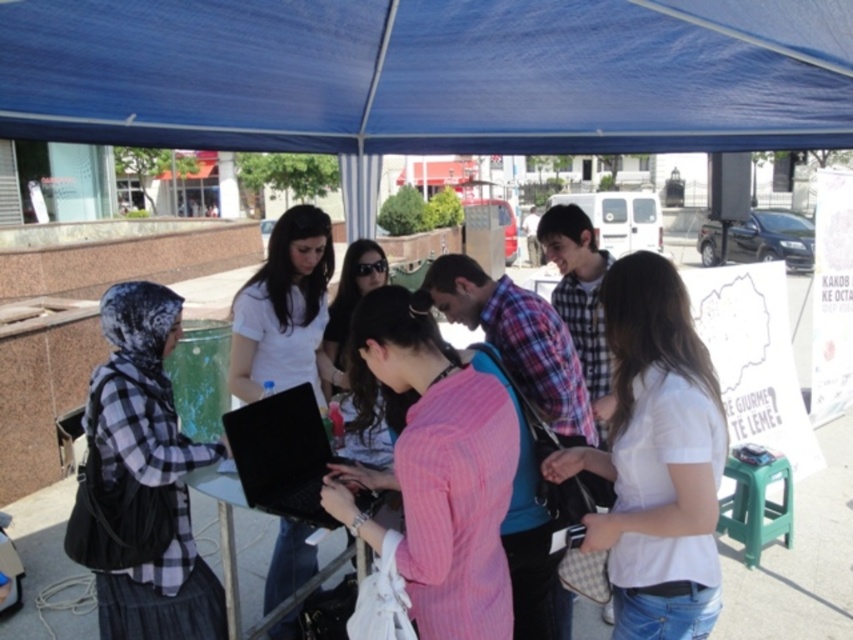
Who is lower down, blue fabric canopy at upper center or plaid fabric shirt at left?

plaid fabric shirt at left

Who is positioned more to the right, blue fabric canopy at upper center or plaid fabric shirt at left?

blue fabric canopy at upper center is more to the right.

Is point (306, 6) behind point (173, 625)?

Yes, point (306, 6) is behind point (173, 625).

The image size is (853, 640). Identify the location of blue fabric canopy at upper center. pos(428,74).

Who is more distant from viewer, (695, 440) or (747, 513)?

The point (747, 513) is more distant.

Measure the distance between white matte shirt at center and camera.

The distance of white matte shirt at center from camera is 1.78 meters.

This screenshot has height=640, width=853. In order to click on white matte shirt at center in this screenshot , I will do 656,458.

Can you confirm if plaid fabric shirt at left is positioned above green plastic stool at lower right?

Yes.

Who is more distant from viewer, (113, 378) or (741, 499)?

The point (741, 499) is more distant.

In order to click on plaid fabric shirt at left in this screenshot , I will do `click(149, 474)`.